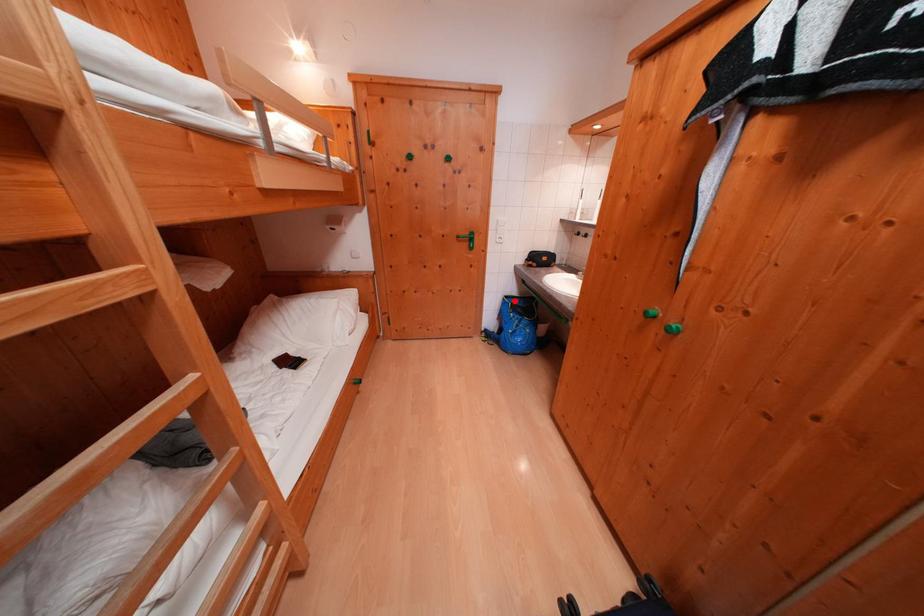
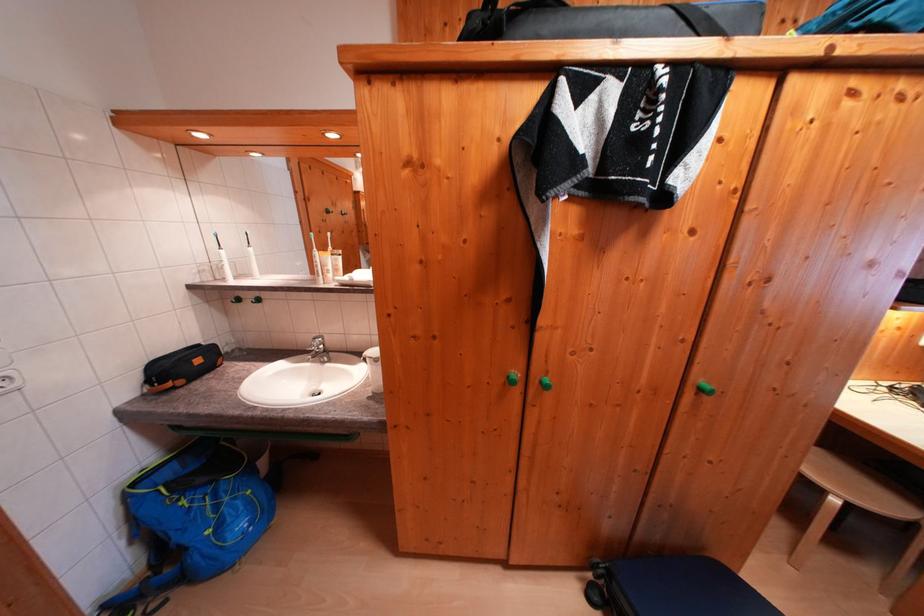
Where in the second image is the point corresponding to the highlighted location from the first image?

(142, 488)